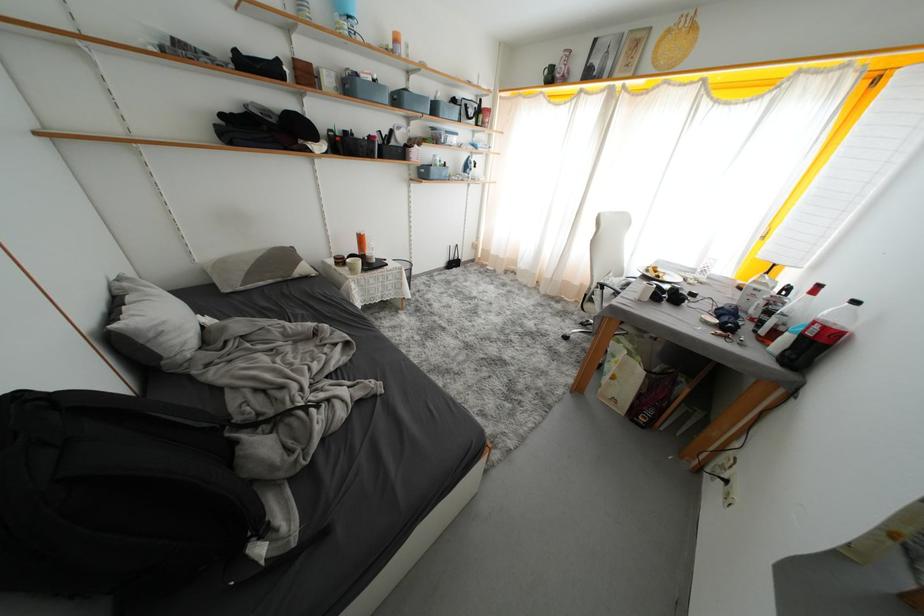
The image size is (924, 616). Find the location of `chair armrest`. chair armrest is located at coordinates (603, 290).